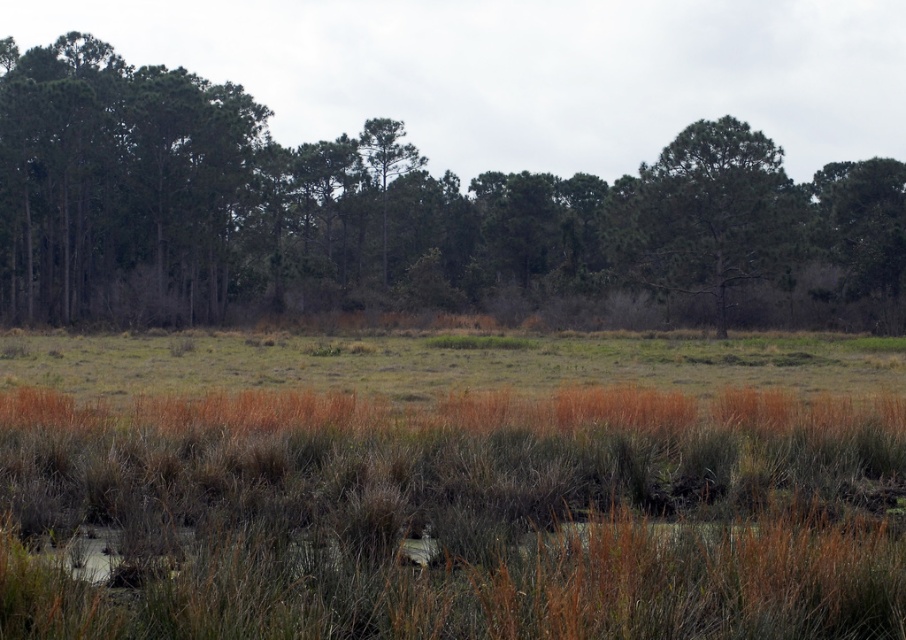
You are standing in the marshy area and want to determine the relative positions of two points marked in the scene. Which point is closer to you, point (278, 237) or point (837, 248)?

Point (278, 237) is further to the camera than point (837, 248), so point (837, 248) is closer to you.

You are an environmental researcher observing the marshy landscape. You notice two green leafy trees in the scene. Which tree, the green leafy tree at center or the green leafy tree at upper right, is taller?

The green leafy tree at center is taller than the green leafy tree at upper right according to the description.